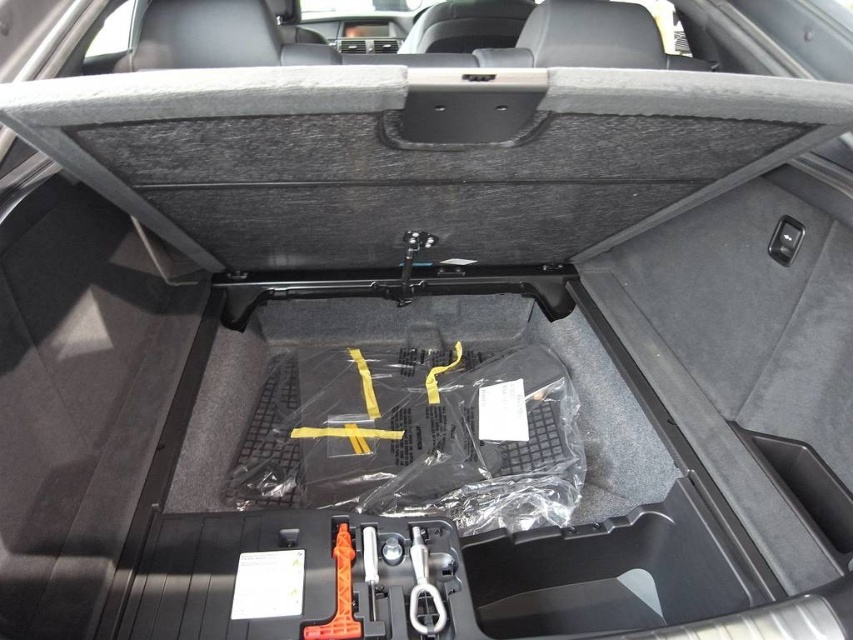
Can you confirm if orange plastic tool at lower center is taller than white plastic tool at center?

Yes.

Based on the photo, is orange plastic tool at lower center bigger than white plastic tool at center?

Correct, orange plastic tool at lower center is larger in size than white plastic tool at center.

Where is `orange plastic tool at lower center`? orange plastic tool at lower center is located at coordinates (339, 593).

Which is more to the left, metallic silver wrench at center or white plastic tool at center?

Positioned to the left is white plastic tool at center.

Is the position of metallic silver wrench at center less distant than that of white plastic tool at center?

Yes, it is in front of white plastic tool at center.

What do you see at coordinates (422, 588) in the screenshot?
I see `metallic silver wrench at center` at bounding box center [422, 588].

You are a GUI agent. You are given a task and a screenshot of the screen. Output one action in this format:
    pyautogui.click(x=<x>, y=<y>)
    Task: Click on the metallic silver wrench at center
    
    Given the screenshot: What is the action you would take?
    pyautogui.click(x=422, y=588)

What do you see at coordinates (339, 593) in the screenshot? This screenshot has height=640, width=853. I see `orange plastic tool at lower center` at bounding box center [339, 593].

Does orange plastic tool at lower center have a lesser height compared to metallic silver wrench at center?

No, orange plastic tool at lower center is not shorter than metallic silver wrench at center.

Is point (338, 563) less distant than point (445, 612)?

That is False.

What are the coordinates of `orange plastic tool at lower center` in the screenshot? It's located at (339, 593).